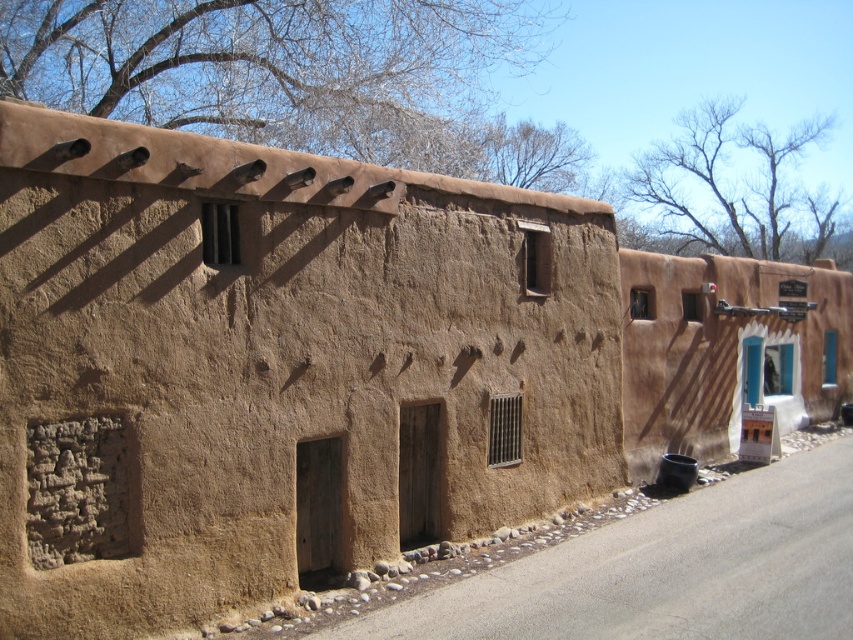
You are standing in front of the row of adobe buildings and want to enter the building closest to you. Which wall should you approach first, the brown mudbrick wall at center or the brown adobe wall at right?

The brown mudbrick wall at center is closer to the viewer than the brown adobe wall at right, so you should approach the brown mudbrick wall at center first to enter the closest building.

You are standing in front of the row of adobe buildings and need to locate the brown mudbrick wall at center. According to the coordinates provided, where exactly would you find it?

The brown mudbrick wall at center is located at point coordinates (276, 369).

You are an architect assessing the structural integrity of the buildings in the scene. Which wall, the brown mudbrick wall at center or the brown adobe wall at right, has a narrower width and might require reinforcement?

The brown mudbrick wall at center has a narrower width than the brown adobe wall at right, so it might require reinforcement.